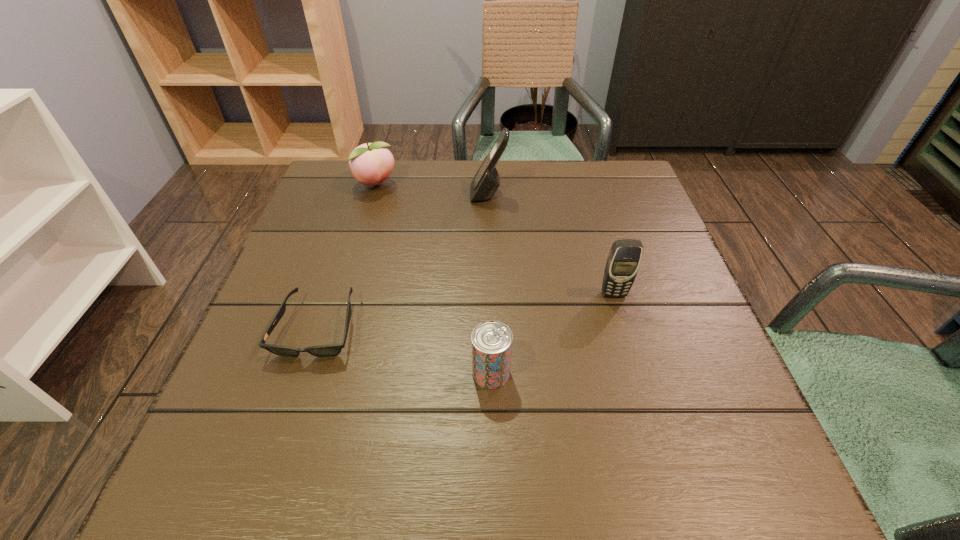
Where is `free space at the far edge of the desktop`? This screenshot has height=540, width=960. free space at the far edge of the desktop is located at coordinates (424, 186).

Where is `vacant region at the near edge of the desktop`? This screenshot has width=960, height=540. vacant region at the near edge of the desktop is located at coordinates (586, 459).

Identify the location of blank area at the left edge. (261, 399).

Where is `vacant region at the right edge`? This screenshot has width=960, height=540. vacant region at the right edge is located at coordinates pyautogui.click(x=666, y=266).

The width and height of the screenshot is (960, 540). In the image, there is a desktop. Identify the location of vacant space at the far left corner. (322, 197).

Where is `vacant point located between the rightmost object and the peach`? The image size is (960, 540). vacant point located between the rightmost object and the peach is located at coordinates (494, 239).

Find the location of a particular element. This screenshot has width=960, height=540. blank region between the beer can and the shortest object is located at coordinates (404, 350).

At what (x,y) coordinates should I click in order to perform the action: click on free point between the shortest object and the fourth tallest object. Please return your answer as a coordinate pair (x, y). This screenshot has width=960, height=540. Looking at the image, I should click on (404, 350).

This screenshot has width=960, height=540. In order to click on vacant space that is in between the sunglasses and the beer can in this screenshot , I will do `click(404, 350)`.

In order to click on free spot between the beer can and the peach in this screenshot , I will do `click(433, 279)`.